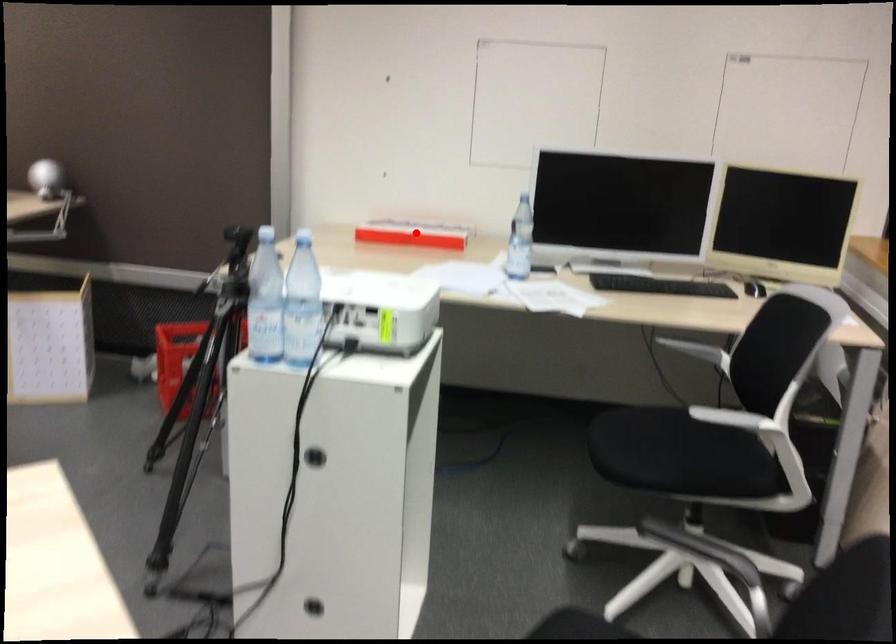
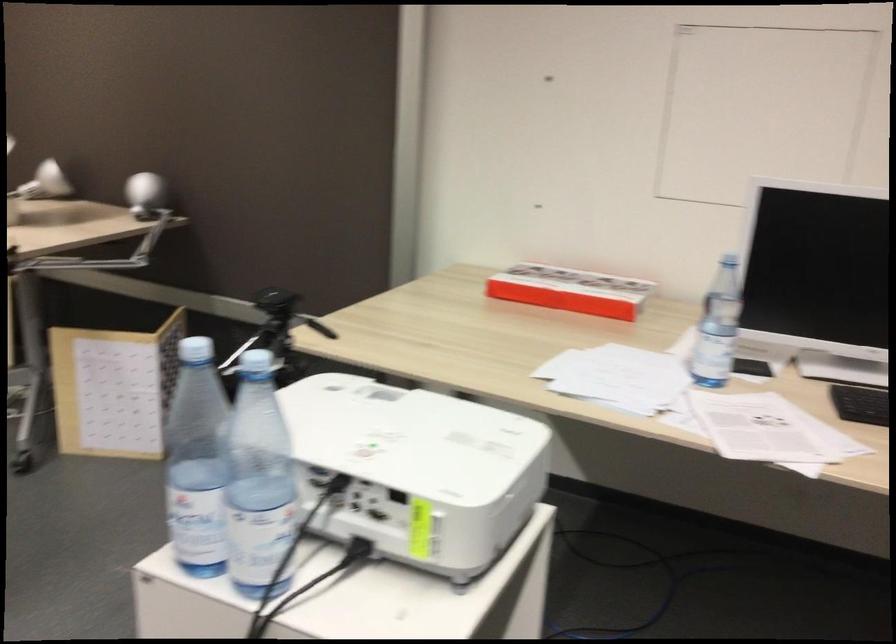
Question: I am providing you with two images of the same scene from different viewpoints. In image1, a red point is highlighted. Considering the same 3D point in image2, which of the following is correct?

Choices:
 (A) It is closer
 (B) It is farther

Answer: (A)